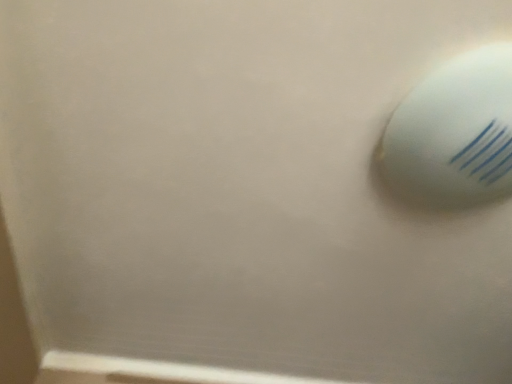
The width and height of the screenshot is (512, 384). Describe the element at coordinates (453, 133) in the screenshot. I see `white glossy egg at upper right` at that location.

I want to click on white glossy egg at upper right, so click(x=453, y=133).

Locate an element on the screen. white glossy egg at upper right is located at coordinates (453, 133).